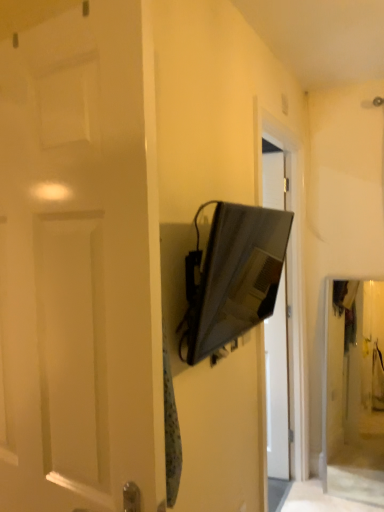
Question: Is point (192, 251) closer or farther from the camera than point (52, 95)?

Choices:
 (A) closer
 (B) farther

Answer: (B)

Question: From the image's perspective, is satin black tv at center positioned above or below white matte door at left?

Choices:
 (A) below
 (B) above

Answer: (B)

Question: From a real-world perspective, relative to white matte door at left, is satin black tv at center vertically above or below?

Choices:
 (A) below
 (B) above

Answer: (B)

Question: From the image's perspective, is white matte door at left above or below satin black tv at center?

Choices:
 (A) above
 (B) below

Answer: (B)

Question: From a real-world perspective, is white matte door at left positioned above or below satin black tv at center?

Choices:
 (A) below
 (B) above

Answer: (A)

Question: Do you think white matte door at left is within satin black tv at center, or outside of it?

Choices:
 (A) inside
 (B) outside

Answer: (B)

Question: Is white matte door at left wider or thinner than satin black tv at center?

Choices:
 (A) thin
 (B) wide

Answer: (B)